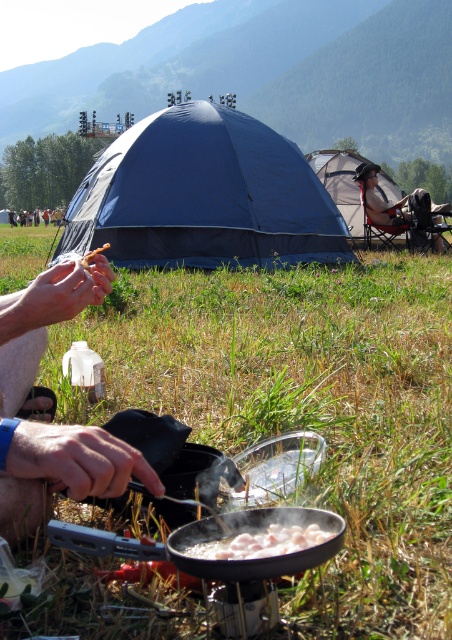
From the picture: You are a hiker who needs to reach the white glossy meat at center from the blue fabric tent at center. Can you walk directly between them without any obstacles?

The distance between blue fabric tent at center and white glossy meat at center is 5.60 meters, so yes, you can walk directly between them without any obstacles as there is no mention of any obstacles in the scene description.